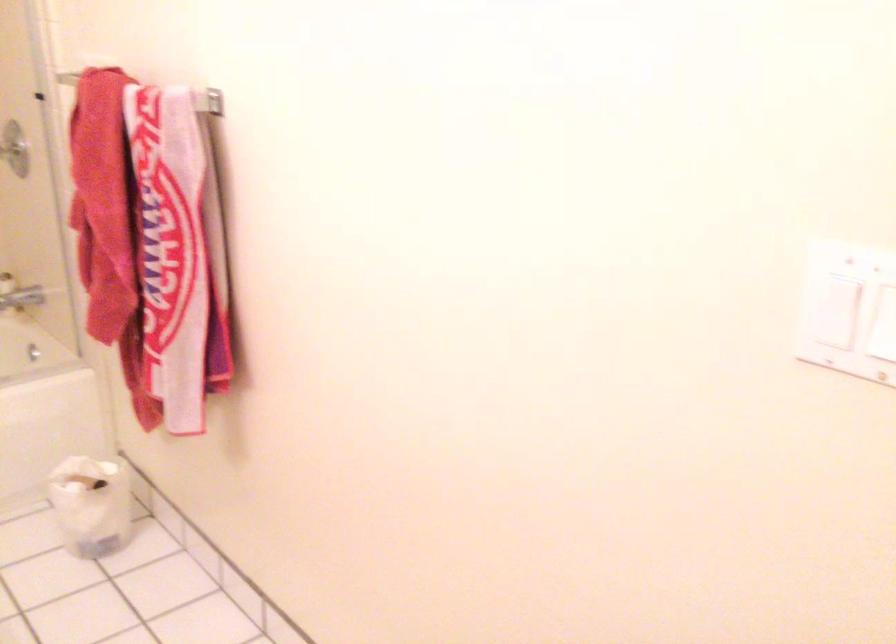
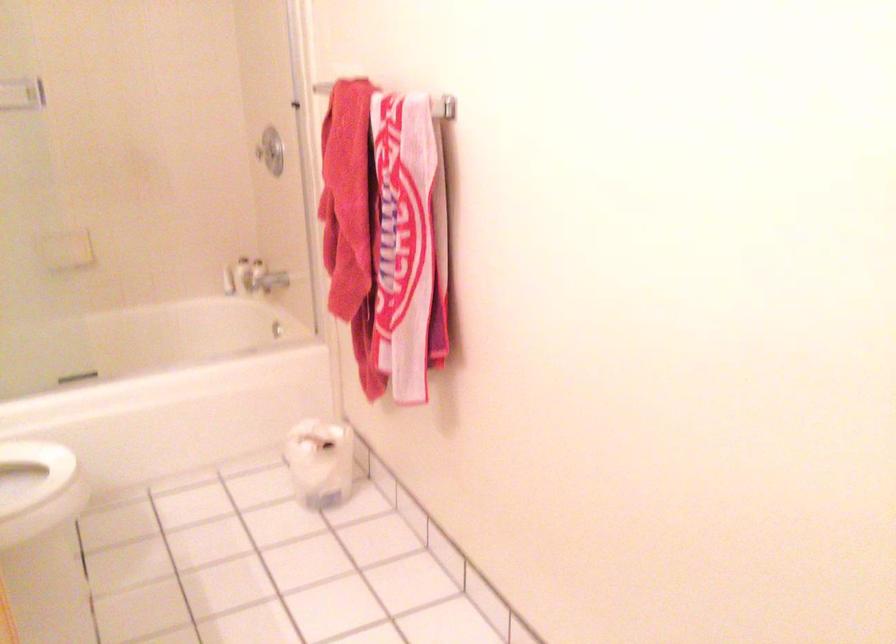
Question: What movement of the cameraman would produce the second image?

Choices:
 (A) Left
 (B) Right
 (C) Forward
 (D) Backward

Answer: (D)